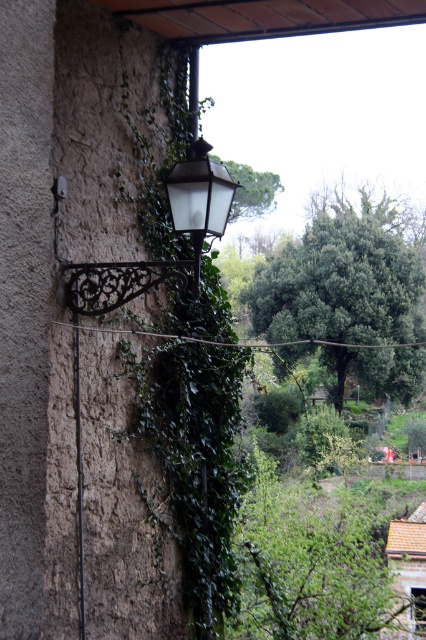
You are an arborist inspecting two green leafy trees in the scene. Which tree, the green leafy tree at center or the green leafy tree at upper center, has a smaller overall size?

The green leafy tree at center occupies less space than the green leafy tree at upper center, so the green leafy tree at center is smaller in size.

You are standing in front of the rustic outdoor scene with the stone wall and the vintage lantern. There are two points marked on the image at coordinates point (388,209) and point (215,173). If you were to walk towards the wall, which point would you reach first?

Point (215,173) would be reached first because it is closer to the viewer compared to point (388,209), which is further away.